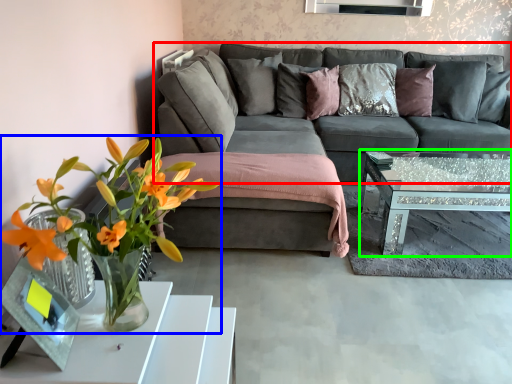
Question: Which is nearer to the studio couch (highlighted by a red box)? houseplant (highlighted by a blue box) or coffee table (highlighted by a green box).

Choices:
 (A) houseplant
 (B) coffee table

Answer: (B)